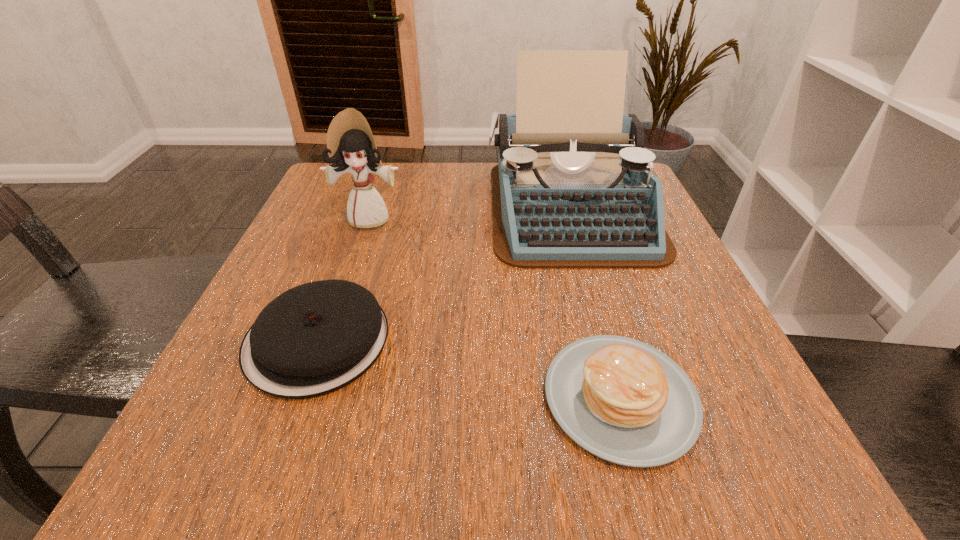
Image resolution: width=960 pixels, height=540 pixels. What are the coordinates of `vacant area that lies between the typewriter and the third tallest object` in the screenshot? It's located at (444, 274).

Find the location of a particular element. The height and width of the screenshot is (540, 960). vacant area that lies between the typewriter and the taller pancake is located at coordinates (444, 274).

Where is `free spot between the typewriter and the shortest object`? The height and width of the screenshot is (540, 960). free spot between the typewriter and the shortest object is located at coordinates (595, 302).

The width and height of the screenshot is (960, 540). I want to click on vacant region between the typewriter and the shortest object, so click(595, 302).

I want to click on free spot between the third shortest object and the shortest object, so click(495, 308).

Locate an element on the screen. This screenshot has height=540, width=960. object that is the second closest to the right pancake is located at coordinates (316, 338).

Where is `the closest object to the taller pancake`? This screenshot has width=960, height=540. the closest object to the taller pancake is located at coordinates (573, 188).

This screenshot has height=540, width=960. Find the location of `vacant region that satisfies the following two spatial constraints: 1. at the front face of the shorter pancake; 2. on the left side of the third shortest object`. vacant region that satisfies the following two spatial constraints: 1. at the front face of the shorter pancake; 2. on the left side of the third shortest object is located at coordinates (310, 397).

Locate an element on the screen. The height and width of the screenshot is (540, 960). vacant region that satisfies the following two spatial constraints: 1. at the front face of the right pancake; 2. on the right side of the doll is located at coordinates (310, 397).

Identify the location of vacant area that satisfies the following two spatial constraints: 1. on the front side of the shortest object; 2. on the right side of the taller pancake. The image size is (960, 540). (297, 397).